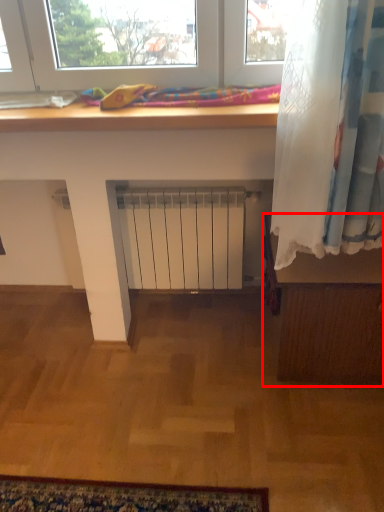
Question: From the image's perspective, where is furniture (annotated by the red box) located relative to bedding?

Choices:
 (A) above
 (B) below

Answer: (B)